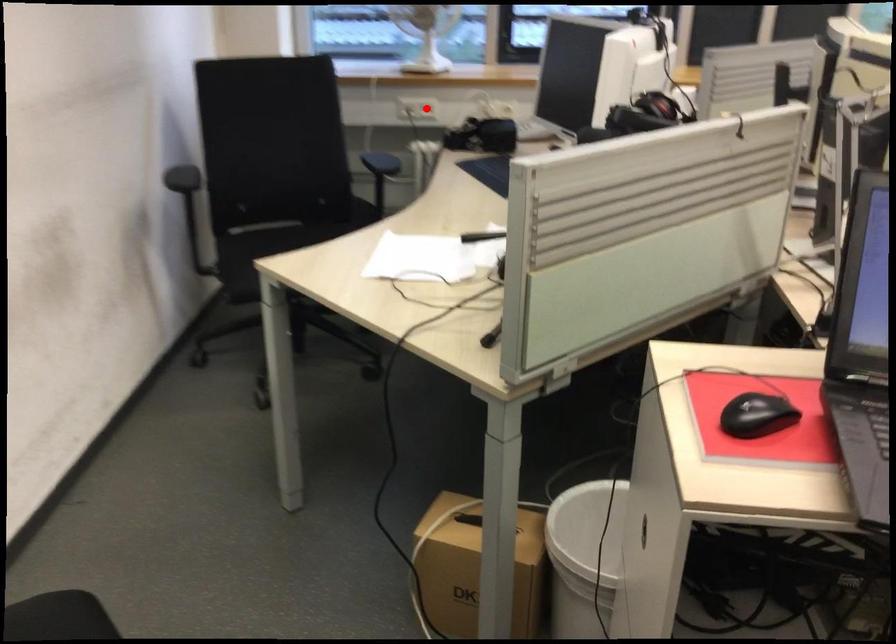
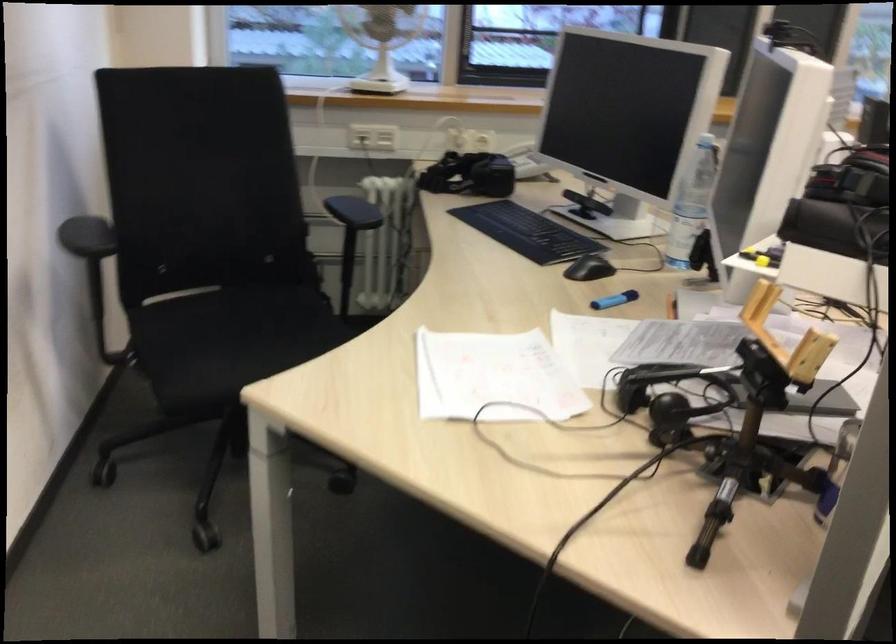
In the second image, find the point that corresponds to the highlighted location in the first image.

(385, 138)